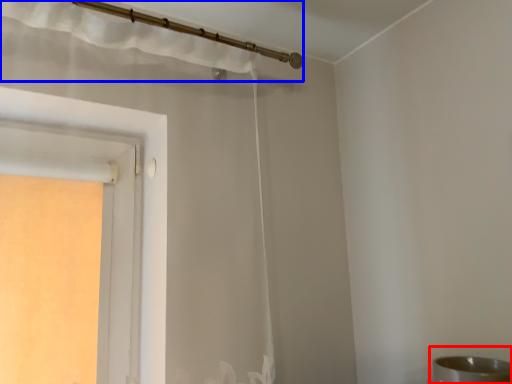
Question: Which point is further to the camera, sink (highlighted by a red box) or curtain (highlighted by a blue box)?

Choices:
 (A) sink
 (B) curtain

Answer: (B)